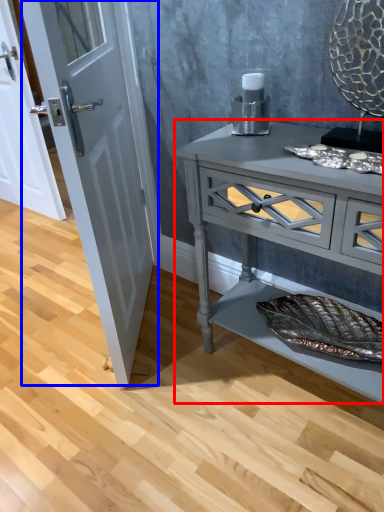
Question: Which point is closer to the camera, chest of drawers (highlighted by a red box) or door (highlighted by a blue box)?

Choices:
 (A) chest of drawers
 (B) door

Answer: (A)